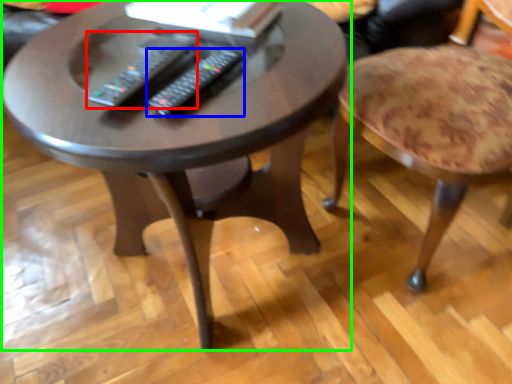
Question: Estimate the real-world distances between objects in this image. Which object is farther from remote (highlighted by a red box), remote (highlighted by a blue box) or coffee table (highlighted by a green box)?

Choices:
 (A) remote
 (B) coffee table

Answer: (B)